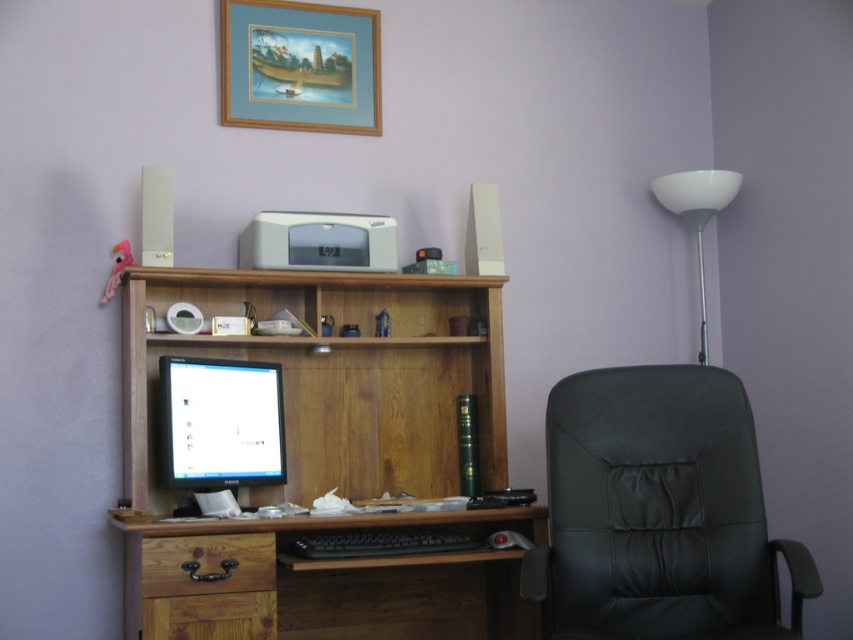
Question: Is woodendesk at center wider than matte black monitor at center?

Choices:
 (A) yes
 (B) no

Answer: (A)

Question: Is brown wood drawer at lower center positioned in front of white plastic floor lamp at upper right?

Choices:
 (A) no
 (B) yes

Answer: (B)

Question: Which object is the farthest from the white plastic floor lamp at upper right?

Choices:
 (A) matte black monitor at center
 (B) woodendesk at center
 (C) matte gray printer at center

Answer: (A)

Question: Among these points, which one is nearest to the camera?

Choices:
 (A) (701, 193)
 (B) (729, 467)
 (C) (474, 346)

Answer: (B)

Question: Where is gold wooden picture frame at upper center located in relation to matte gray printer at center in the image?

Choices:
 (A) left
 (B) right

Answer: (A)

Question: Which object is closer to the camera taking this photo?

Choices:
 (A) woodendesk at center
 (B) gold wooden picture frame at upper center
 (C) brown wood drawer at lower center
 (D) black plastic keyboard at center

Answer: (A)